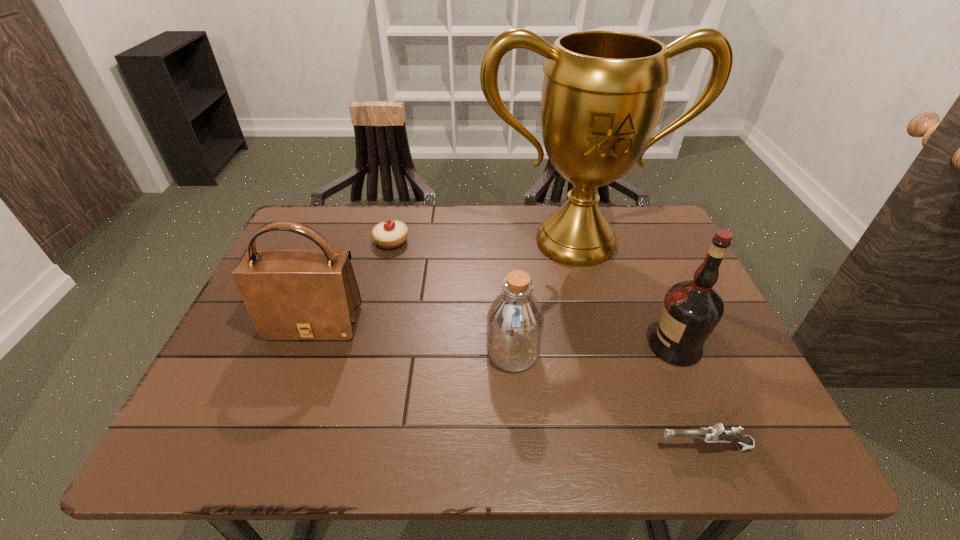
Where is `trophy cup`? The height and width of the screenshot is (540, 960). trophy cup is located at coordinates (602, 94).

You are a GUI agent. You are given a task and a screenshot of the screen. Output one action in this format:
    pyautogui.click(x=<x>, y=<y>)
    Task: Click on the liquor
    This screenshot has height=540, width=960.
    Given the screenshot: What is the action you would take?
    pyautogui.click(x=691, y=310)

At what (x,y) coordinates should I click in order to perform the action: click on shoulder bag. Please return your answer as a coordinate pair (x, y). The height and width of the screenshot is (540, 960). Looking at the image, I should click on (290, 294).

Locate an element on the screen. bottle is located at coordinates [515, 320].

In order to click on pastry in this screenshot , I will do `click(390, 234)`.

This screenshot has width=960, height=540. In order to click on gun in this screenshot , I will do `click(717, 433)`.

The width and height of the screenshot is (960, 540). What are the coordinates of `vacant space situated on the surface of the trophy cup with symbols` in the screenshot? It's located at (591, 301).

The image size is (960, 540). I want to click on vacant space situated 0.280m on the surface of the liquor, so click(525, 346).

Find the location of a particular element. The height and width of the screenshot is (540, 960). vacant region located on the surface of the liquor is located at coordinates (521, 346).

This screenshot has height=540, width=960. I want to click on vacant region located on the surface of the liquor, so click(x=521, y=346).